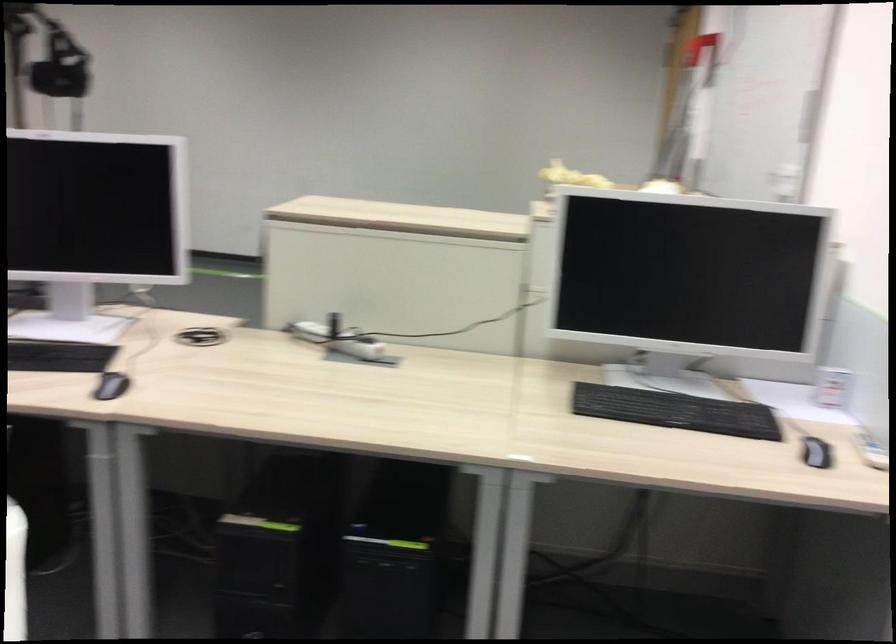
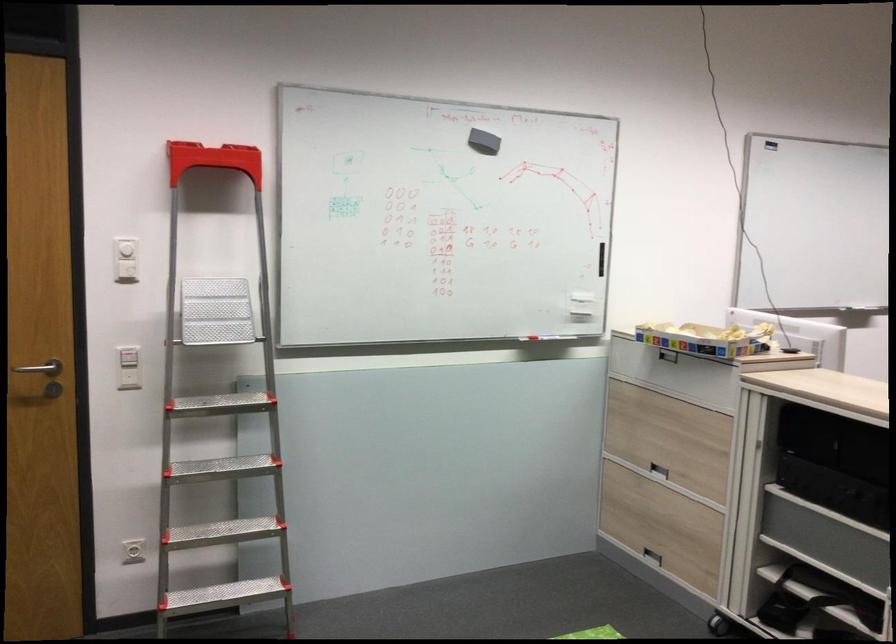
Locate, in the second image, the point that corresponds to point (754, 196) in the first image.

(539, 337)